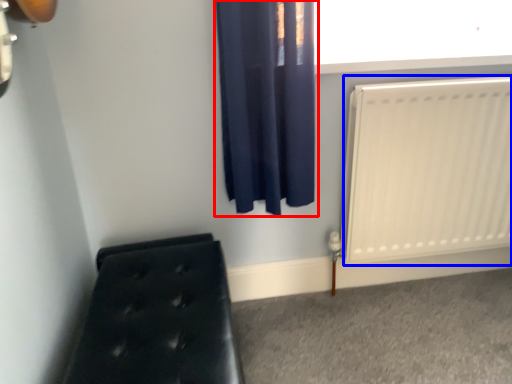
Question: Which point is further to the camera, curtain (highlighted by a red box) or radiator (highlighted by a blue box)?

Choices:
 (A) curtain
 (B) radiator

Answer: (B)